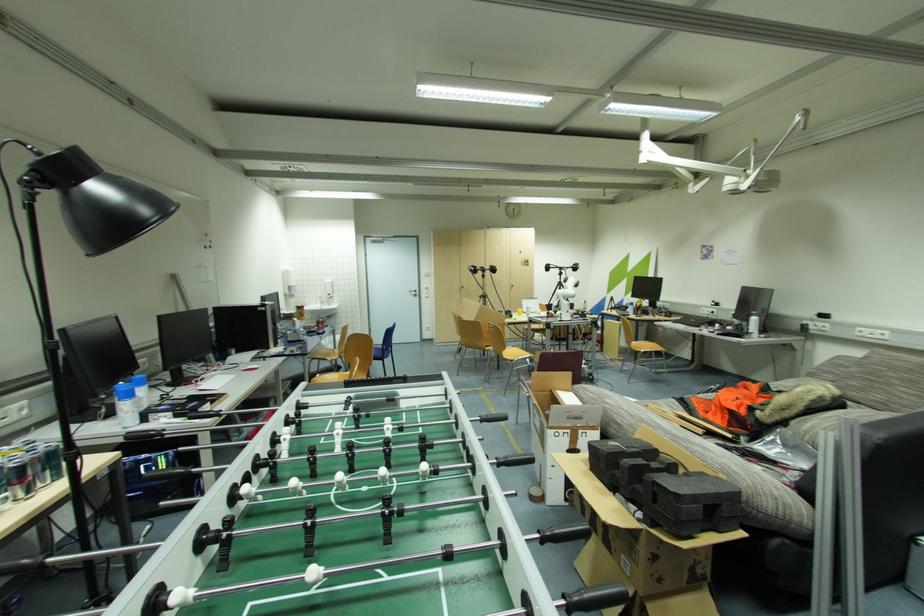
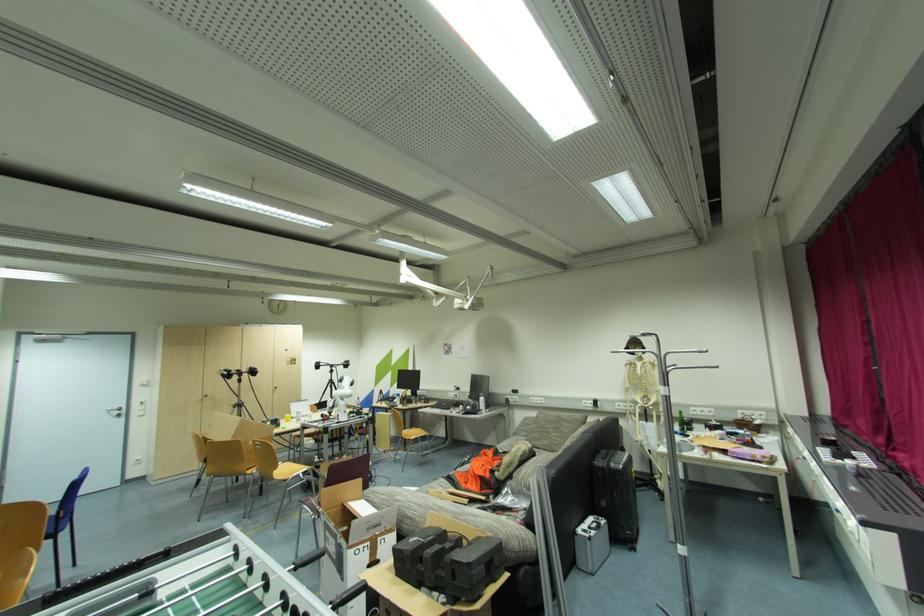
Locate, in the second image, the point that corresponds to (x=507, y=350) in the first image.

(280, 469)